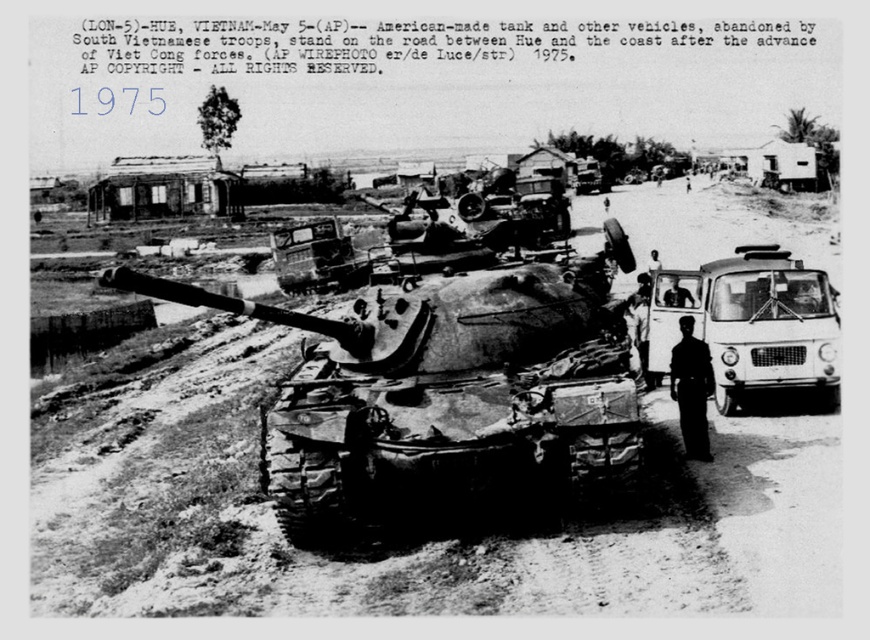
Question: Among these objects, which one is nearest to the camera?

Choices:
 (A) dark uniform at center
 (B) dark skin human at center

Answer: (A)

Question: Can you confirm if white matte van at right is positioned below dark uniform at center?

Choices:
 (A) yes
 (B) no

Answer: (A)

Question: Which point is closer to the camera?

Choices:
 (A) dark skin human at center
 (B) dark uniform at center
 (C) white matte van at right
 (D) weathered steel tank at center

Answer: (B)

Question: Where is white matte van at right located in relation to dark uniform at center in the image?

Choices:
 (A) below
 (B) above

Answer: (A)

Question: Among these points, which one is nearest to the camera?

Choices:
 (A) (771, 243)
 (B) (690, 348)
 (C) (579, 456)
 (D) (673, 276)

Answer: (C)

Question: Is dark uniform at center to the right of dark skin human at center from the viewer's perspective?

Choices:
 (A) no
 (B) yes

Answer: (A)